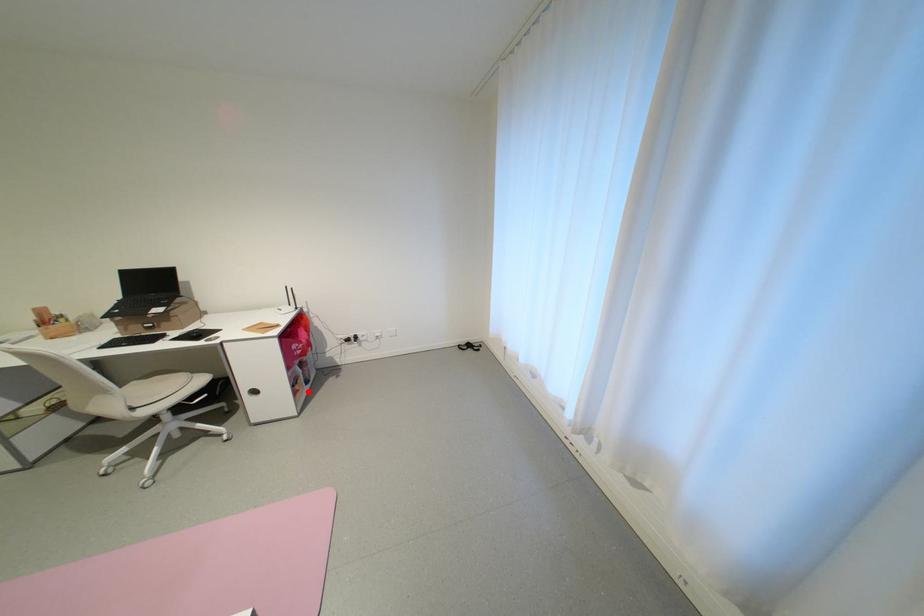
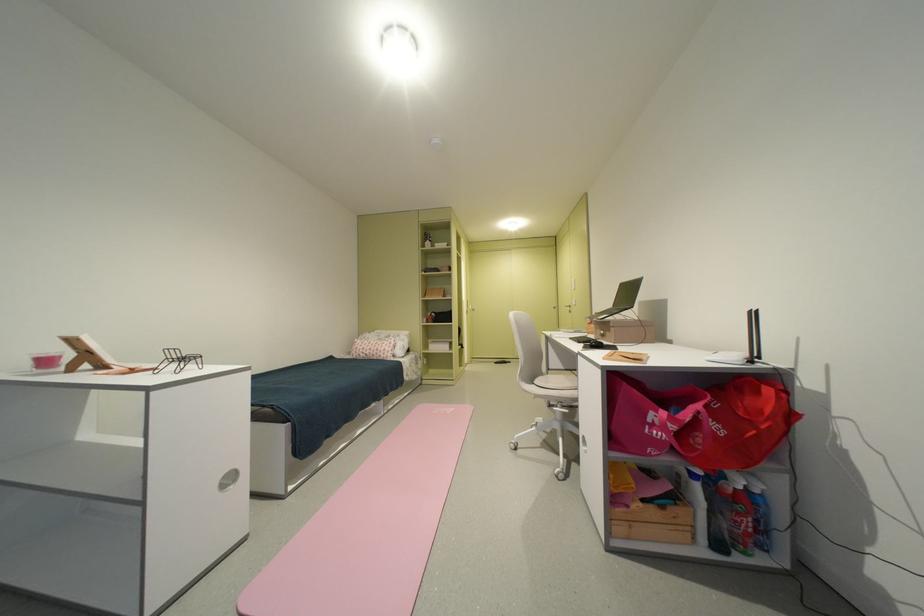
Find the pixel in the second image that matches the highlighted location in the first image.

(638, 508)